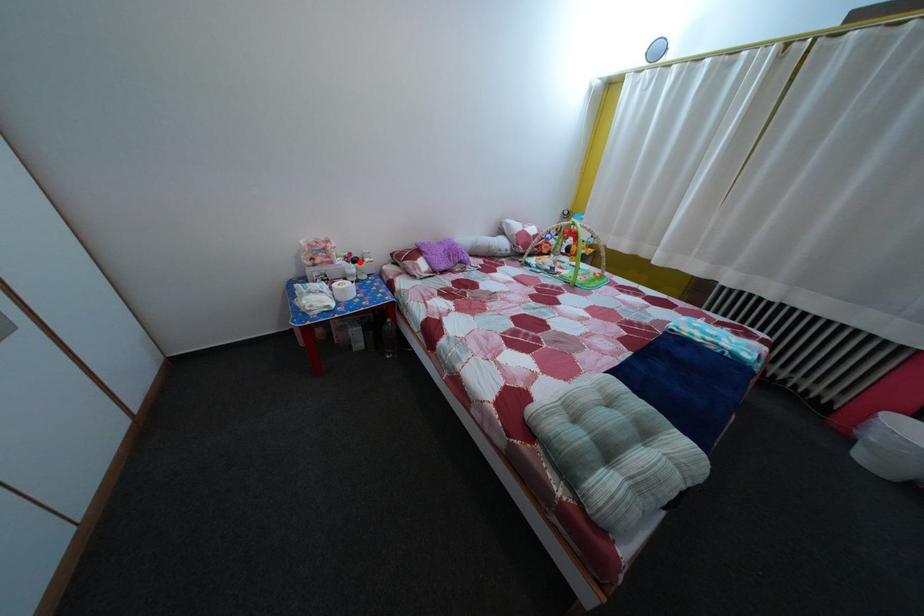
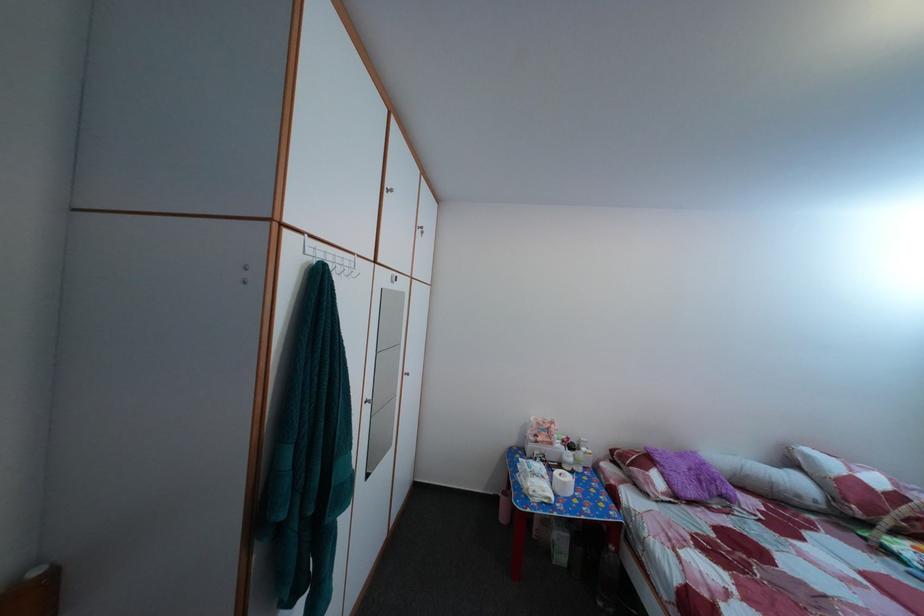
Question: I am providing you with two images of the same scene from different viewpoints. Image1 has a red point marked. In image2, the corresponding 3D location appears at what relative position? Reply with the corresponding letter.

Choices:
 (A) Closer
 (B) Farther

Answer: (B)